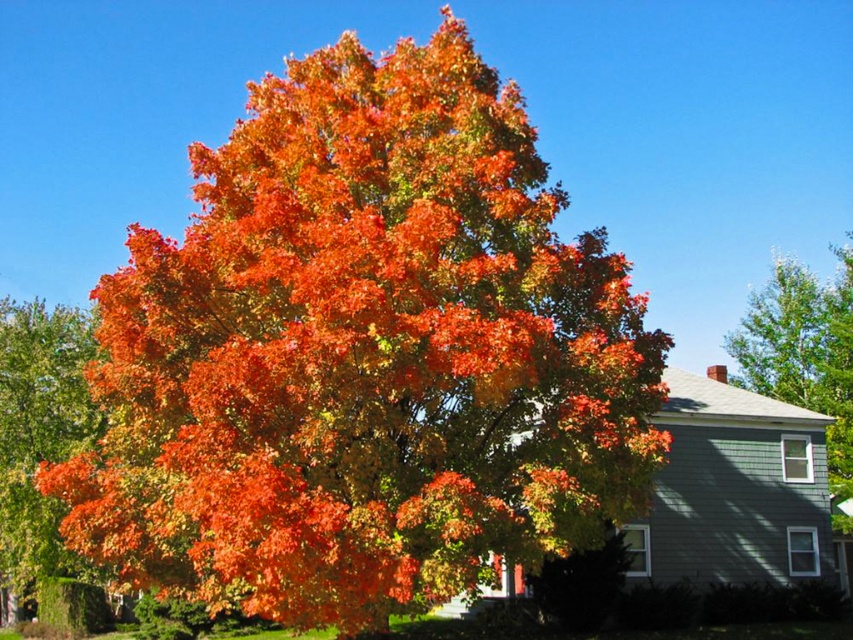
Question: Which point is farther from the camera taking this photo?

Choices:
 (A) (213, 380)
 (B) (816, 394)

Answer: (B)

Question: Does orange leafy tree at center have a lesser width compared to green leafy tree at upper right?

Choices:
 (A) no
 (B) yes

Answer: (A)

Question: Which point is farther to the camera?

Choices:
 (A) orange leafy tree at center
 (B) green leafy tree at upper right

Answer: (B)

Question: Based on their relative distances, which object is nearer to the orange leafy tree at center?

Choices:
 (A) green leafy tree at upper right
 (B) shiny orange leaves at center

Answer: (B)

Question: Is shiny orange leaves at center wider than green leafy tree at upper right?

Choices:
 (A) no
 (B) yes

Answer: (A)

Question: Does shiny orange leaves at center have a greater width compared to green leafy tree at upper right?

Choices:
 (A) yes
 (B) no

Answer: (B)